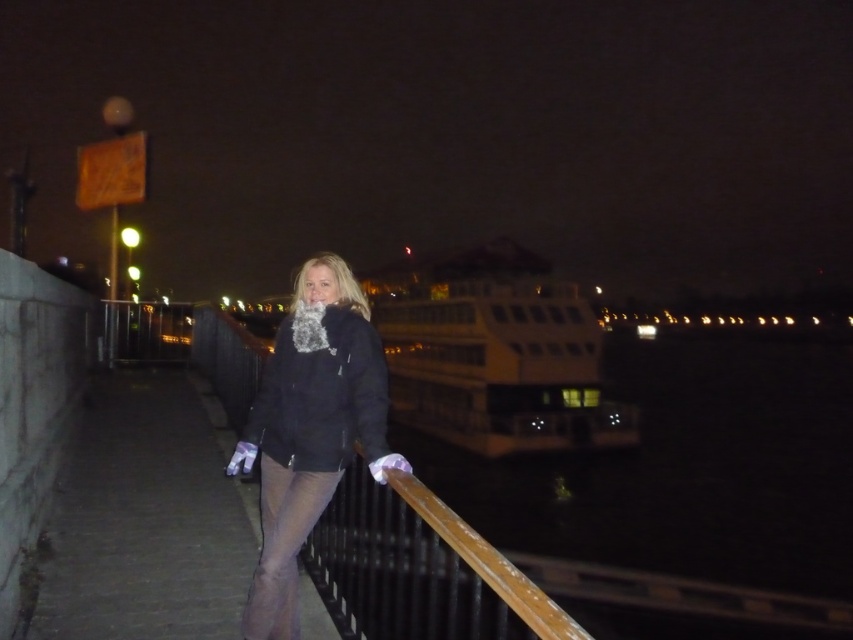
Question: Can you confirm if wooden at center is positioned to the right of matte black jacket at center?

Choices:
 (A) yes
 (B) no

Answer: (A)

Question: Considering the relative positions of wooden at center and matte black jacket at center in the image provided, where is wooden at center located with respect to matte black jacket at center?

Choices:
 (A) below
 (B) above

Answer: (A)

Question: Does wooden at center have a smaller size compared to matte black jacket at center?

Choices:
 (A) no
 (B) yes

Answer: (B)

Question: Among these points, which one is farthest from the camera?

Choices:
 (A) (247, 628)
 (B) (440, 548)

Answer: (A)

Question: Which object is closer to the camera taking this photo?

Choices:
 (A) wooden at center
 (B) matte black jacket at center

Answer: (A)